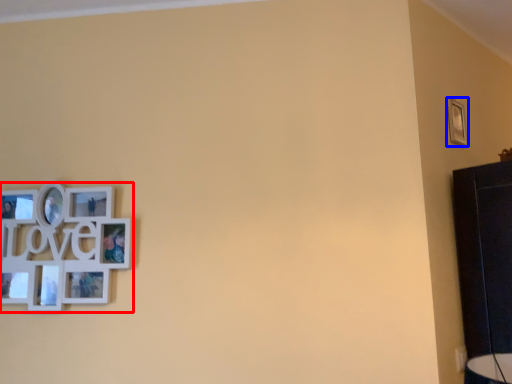
Question: Which object appears farthest to the camera in this image, picture frame (highlighted by a red box) or picture frame (highlighted by a blue box)?

Choices:
 (A) picture frame
 (B) picture frame

Answer: (B)